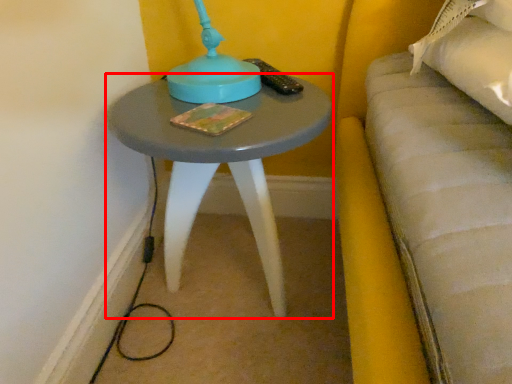
Question: From the image's perspective, what is the correct spatial positioning of table (annotated by the red box) in reference to book?

Choices:
 (A) above
 (B) below

Answer: (B)